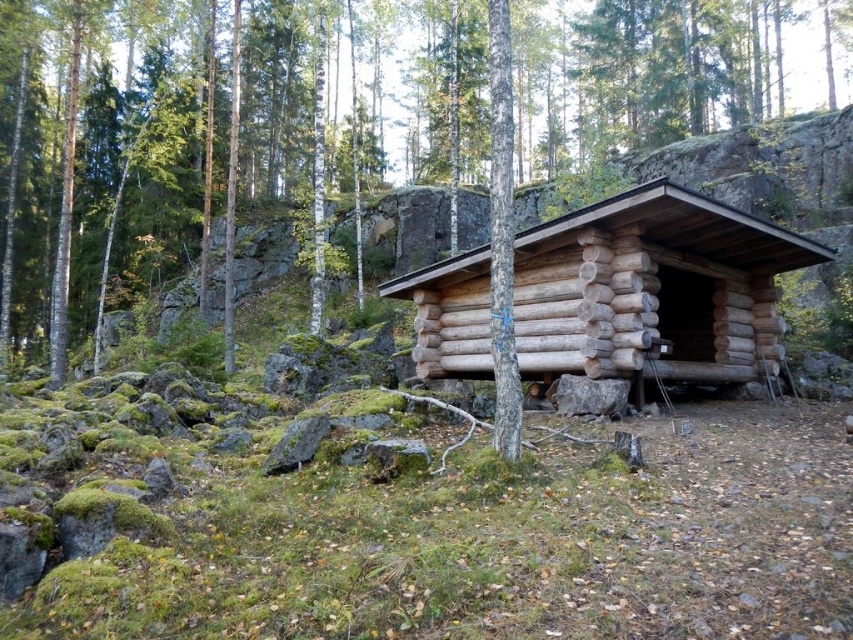
Which is below, brown wood log cabin at center or natural wood log cabin at center?

natural wood log cabin at center is lower down.

Is brown wood log cabin at center smaller than natural wood log cabin at center?

No, brown wood log cabin at center is not smaller than natural wood log cabin at center.

Where is `brown wood log cabin at center`? brown wood log cabin at center is located at coordinates [223, 152].

Where is `brown wood log cabin at center`? The height and width of the screenshot is (640, 853). brown wood log cabin at center is located at coordinates (223, 152).